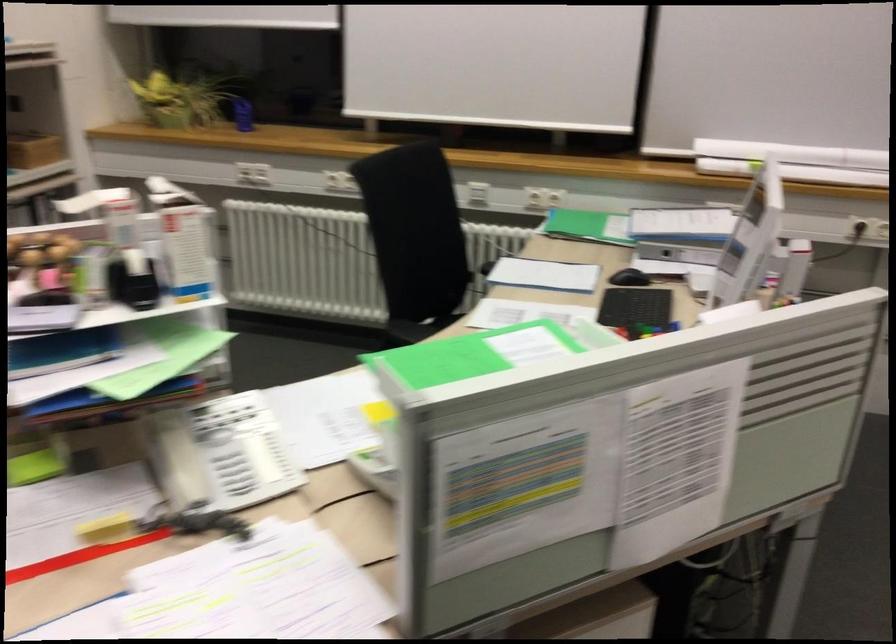
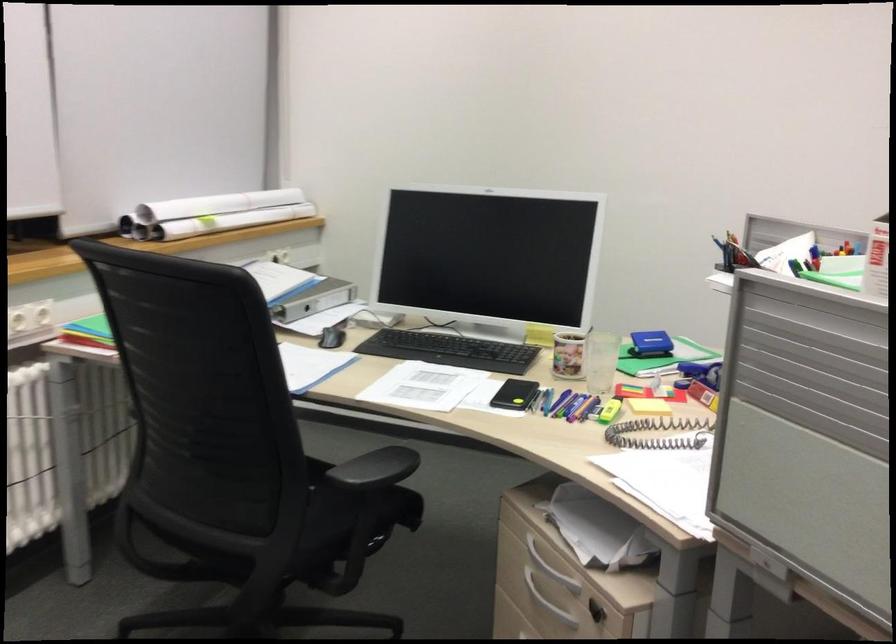
In the second image, find the point that corresponds to (668,245) in the first image.

(314, 299)